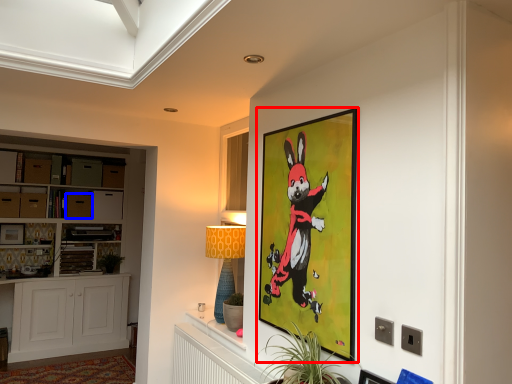
Question: Which point is further to the camera, picture frame (highlighted by a red box) or drawer (highlighted by a blue box)?

Choices:
 (A) picture frame
 (B) drawer

Answer: (B)